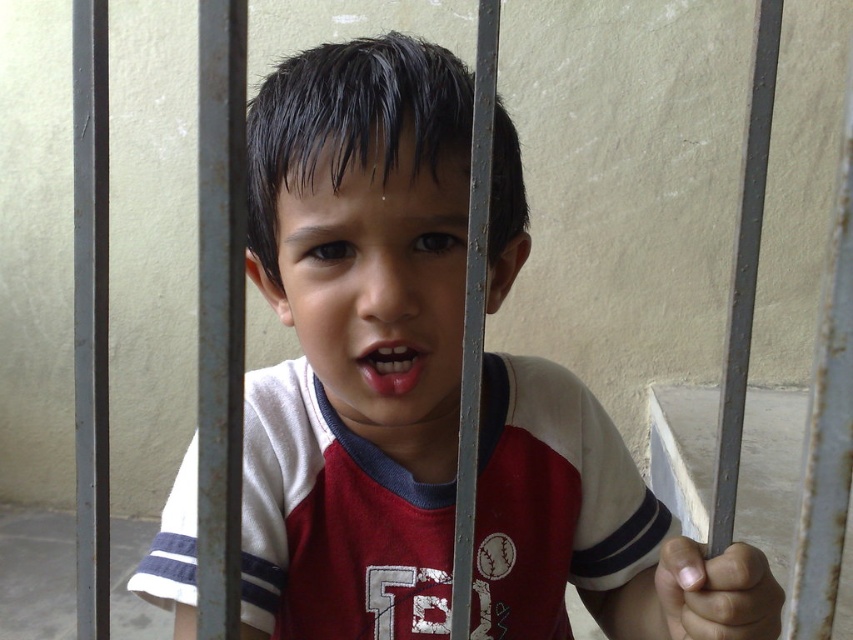
Question: Can you confirm if white cotton shirt at center is smaller than pink glossy lips at center?

Choices:
 (A) no
 (B) yes

Answer: (A)

Question: From the image, what is the correct spatial relationship of white cotton shirt at center in relation to smooth skin face at center?

Choices:
 (A) right
 (B) left

Answer: (A)

Question: Which of the following is the farthest from the observer?

Choices:
 (A) white cotton shirt at center
 (B) smooth skin face at center
 (C) pink glossy lips at center

Answer: (C)

Question: Is white cotton shirt at center below smooth skin face at center?

Choices:
 (A) yes
 (B) no

Answer: (A)

Question: Which point is closer to the camera?

Choices:
 (A) smooth skin face at center
 (B) white cotton shirt at center

Answer: (B)

Question: Which point is farther from the camera taking this photo?

Choices:
 (A) (575, 525)
 (B) (376, 376)
 (C) (351, 164)

Answer: (A)